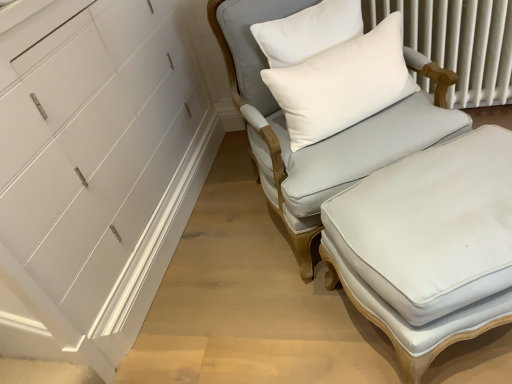
Find the location of `free space to the left of light gray fabric chair at center`. free space to the left of light gray fabric chair at center is located at coordinates (223, 251).